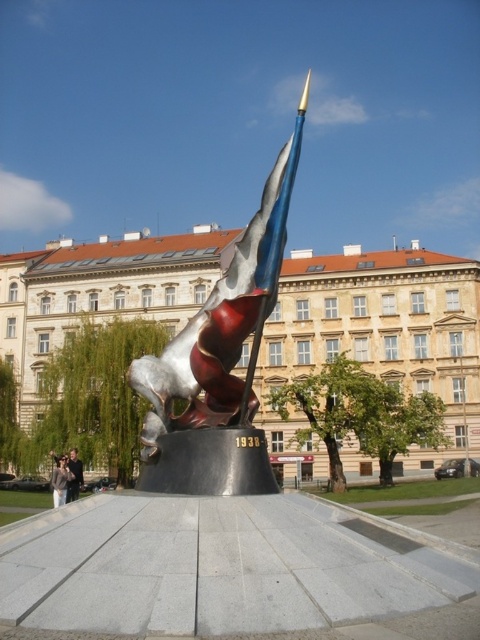
Between metallic building at center and metallic sculpture at center, which one appears on the right side from the viewer's perspective?

From the viewer's perspective, metallic sculpture at center appears more on the right side.

Consider the image. Is metallic building at center above metallic sculpture at center?

No.

Is point (363, 253) in front of point (213, 467)?

No, (363, 253) is behind (213, 467).

Locate an element on the screen. metallic building at center is located at coordinates (379, 336).

Which of these two, metallic sculpture at center or light brown leather jacket at lower left, stands taller?

metallic sculpture at center

Which is below, metallic sculpture at center or light brown leather jacket at lower left?

light brown leather jacket at lower left is lower down.

Is point (156, 448) closer to viewer compared to point (66, 458)?

Yes, it is.

This screenshot has height=640, width=480. I want to click on metallic sculpture at center, so click(x=219, y=362).

Consider the image. Who is positioned more to the left, metallic sculpture at center or dark blue jeans at lower left?

Positioned to the left is dark blue jeans at lower left.

Can you confirm if metallic sculpture at center is positioned above dark blue jeans at lower left?

Indeed, metallic sculpture at center is positioned over dark blue jeans at lower left.

Who is more distant from viewer, (220,413) or (76,468)?

Positioned behind is point (76,468).

The image size is (480, 640). I want to click on metallic sculpture at center, so click(x=219, y=362).